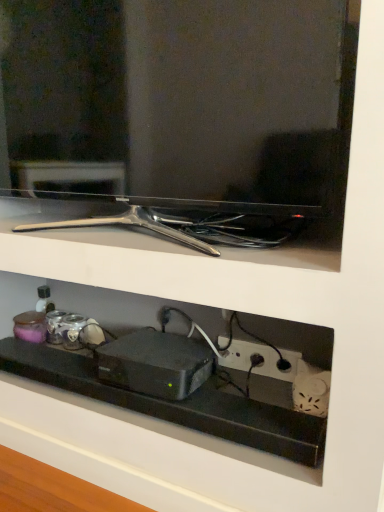
You are a GUI agent. You are given a task and a screenshot of the screen. Output one action in this format:
    pyautogui.click(x=<x>, y=<y>)
    Task: Click on the vacant space underneath matte black tv at upper center (from a real-world perspective)
    This screenshot has height=512, width=384.
    Given the screenshot: What is the action you would take?
    pyautogui.click(x=127, y=237)